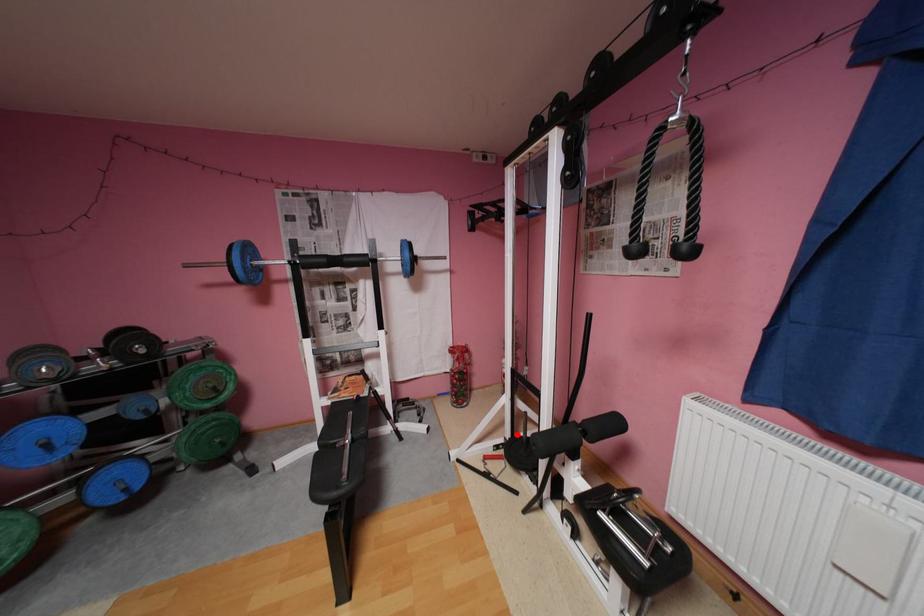
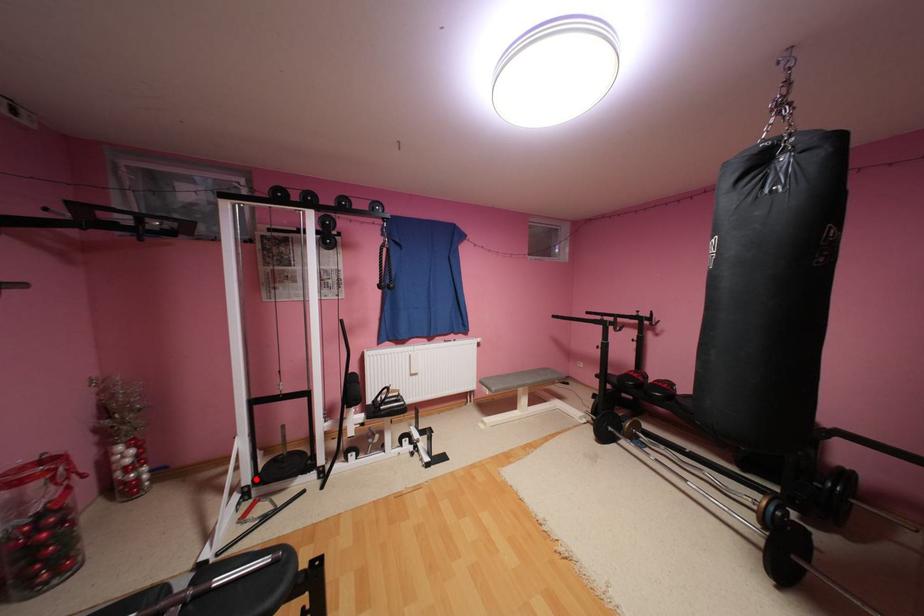
I am providing you with two images of the same scene from different viewpoints. A red point is marked on the first image and another point is marked on the second image. Do the highlighted points in image1 and image2 indicate the same real-world spot?

Yes